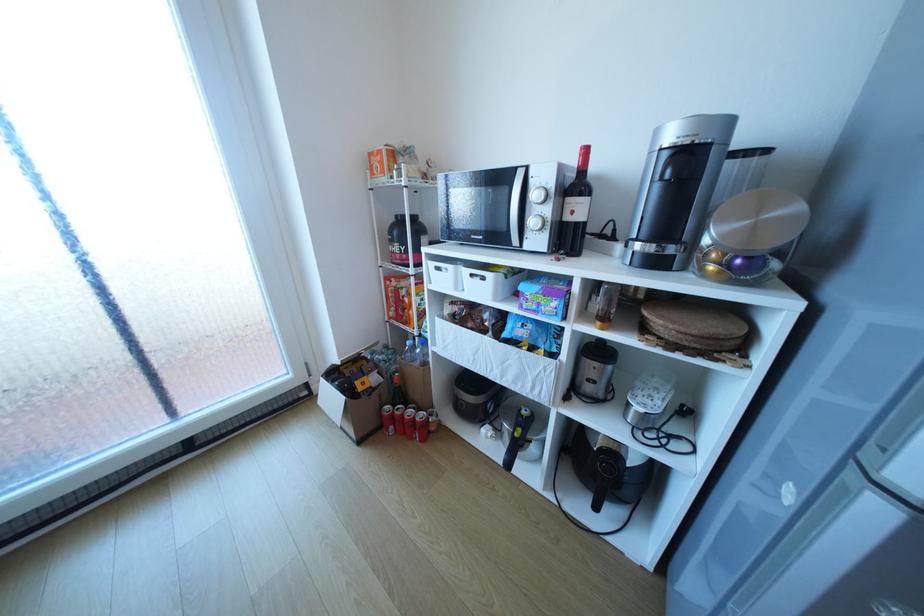
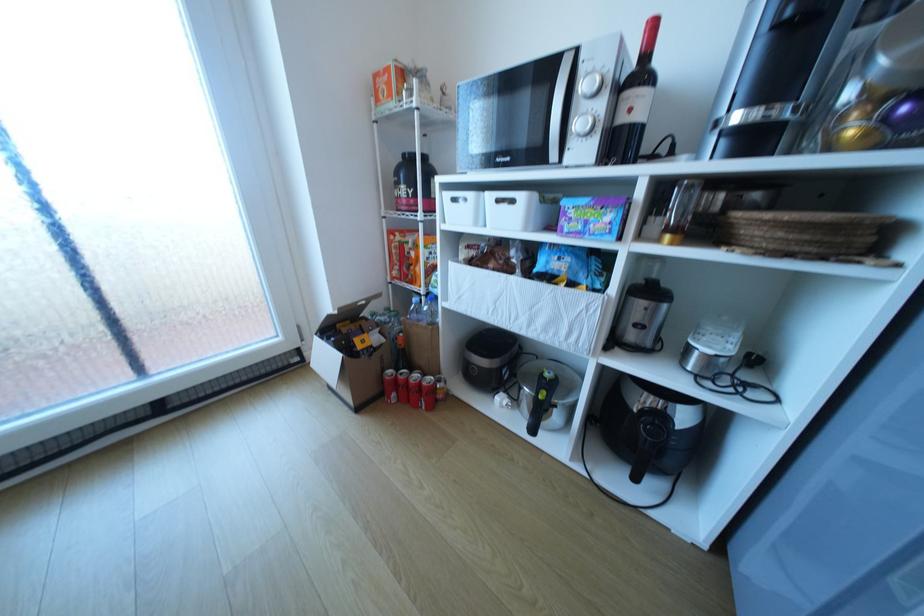
Question: How did the camera likely rotate?

Choices:
 (A) Left
 (B) Right
 (C) Up
 (D) Down

Answer: (D)